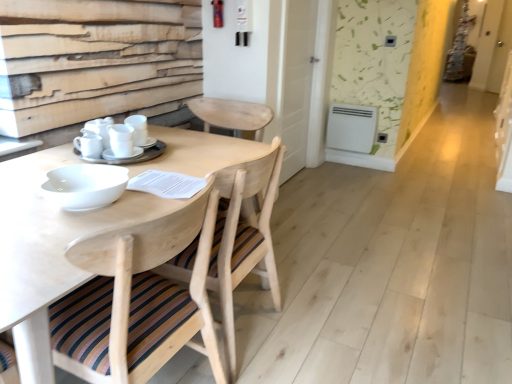
At what (x,y) coordinates should I click in order to perform the action: click on vacant space to the right of natural wood chair at center, which is the second chair from front to back. Please return your answer as a coordinate pair (x, y). This screenshot has width=512, height=384. Looking at the image, I should click on (311, 327).